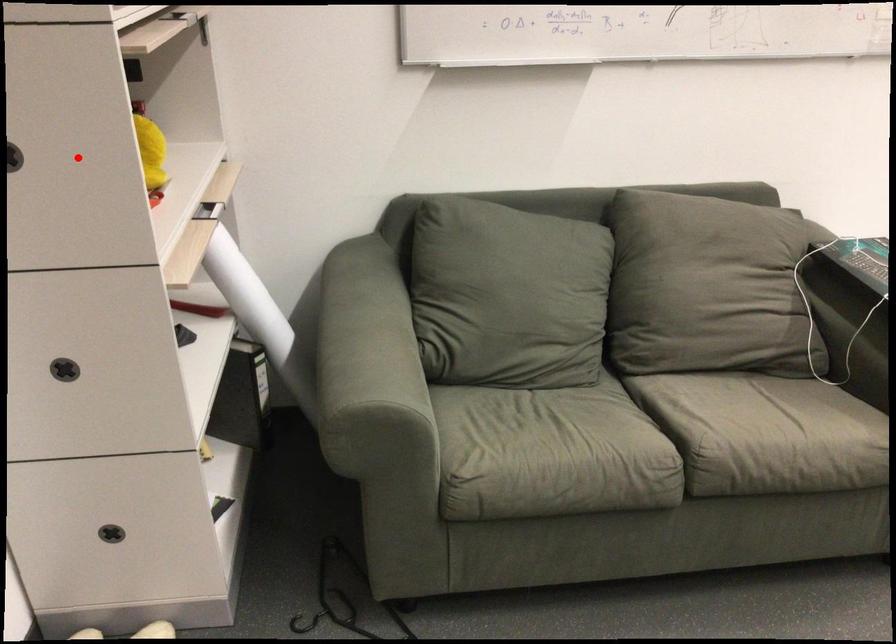
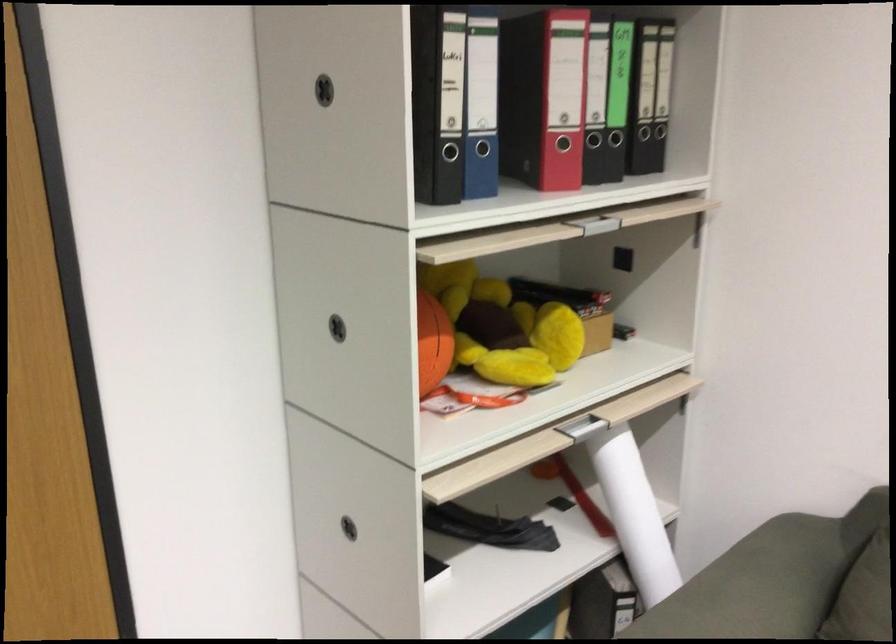
Find the pixel in the second image that matches the highlighted location in the first image.

(433, 343)